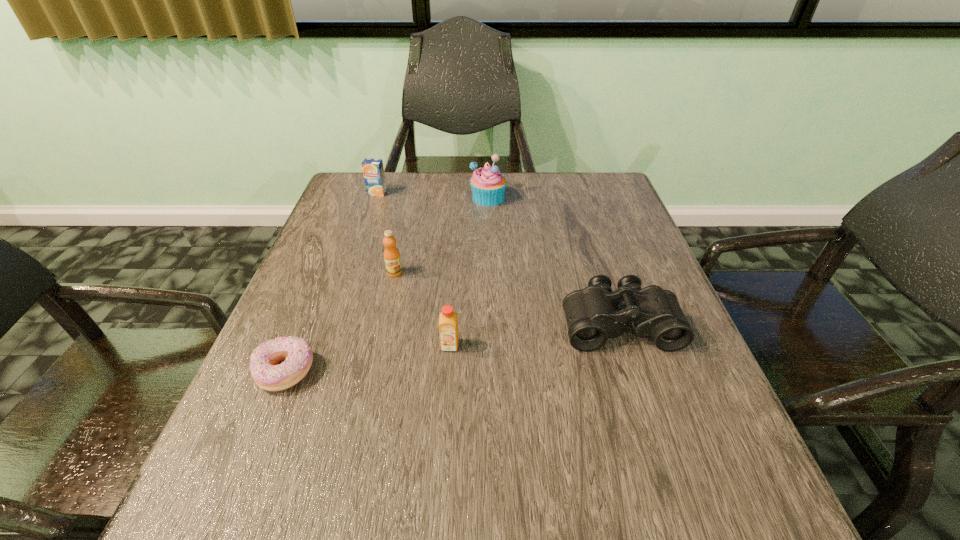
What are the coordinates of `unoccupied position between the farthest orange juice and the rightmost object` in the screenshot? It's located at (498, 258).

Find the location of a particular element. empty space between the shortest object and the second object from right to left is located at coordinates (388, 285).

This screenshot has width=960, height=540. Identify the location of vacant region between the nearest orange juice and the third farthest object. (422, 309).

This screenshot has width=960, height=540. I want to click on empty space between the doughnut and the fifth object from left to right, so click(388, 285).

I want to click on free space between the muffin and the fourth object from right to left, so click(x=442, y=235).

Locate an element on the screen. This screenshot has width=960, height=540. unoccupied area between the fifth object from left to right and the binoculars is located at coordinates (554, 260).

Point out which object is positioned as the fourth nearest to the muffin. Please provide its 2D coordinates. Your answer should be formatted as a tuple, i.e. [(x, y)], where the tuple contains the x and y coordinates of a point satisfying the conditions above.

[(448, 326)]

The image size is (960, 540). Identify the location of object that can be found as the second closest to the leftmost orange juice. (392, 259).

Identify the location of orange juice that is the closest to the rightmost orange juice. Image resolution: width=960 pixels, height=540 pixels. (392, 259).

Select which orange juice is the second closest to the fourth object from left to right. Please provide its 2D coordinates. Your answer should be formatted as a tuple, i.e. [(x, y)], where the tuple contains the x and y coordinates of a point satisfying the conditions above.

[(373, 171)]